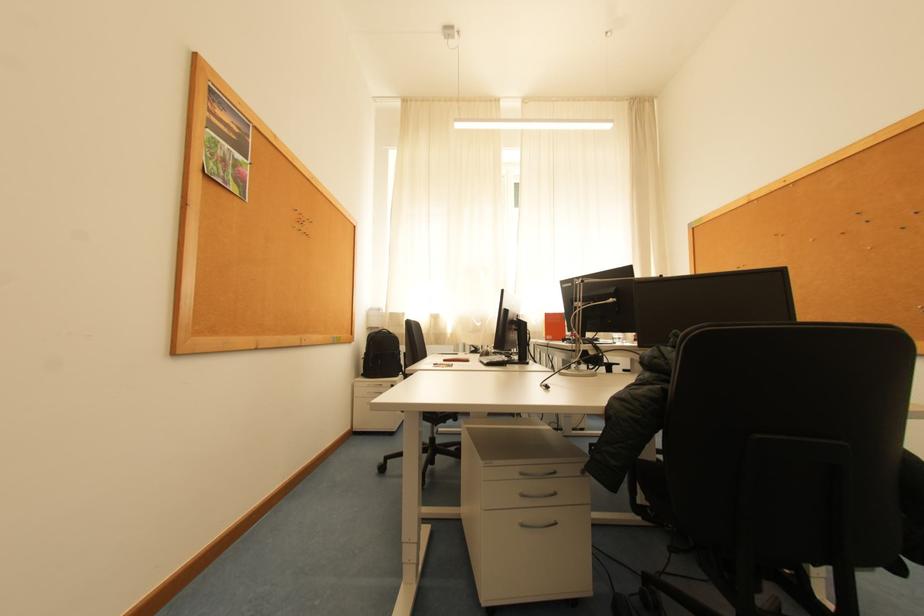
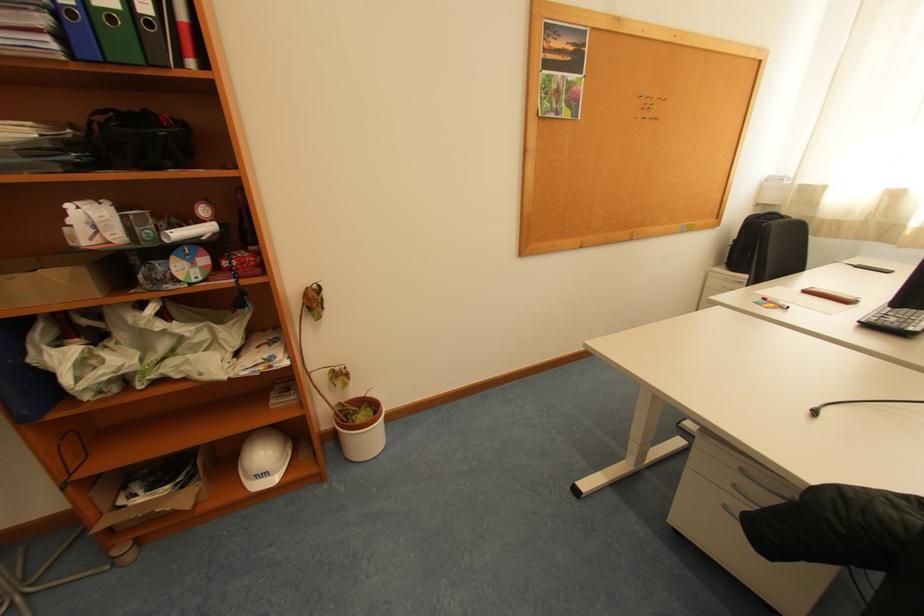
Based on the continuous images, in which direction is the camera rotating?

The camera rotated toward left-down.